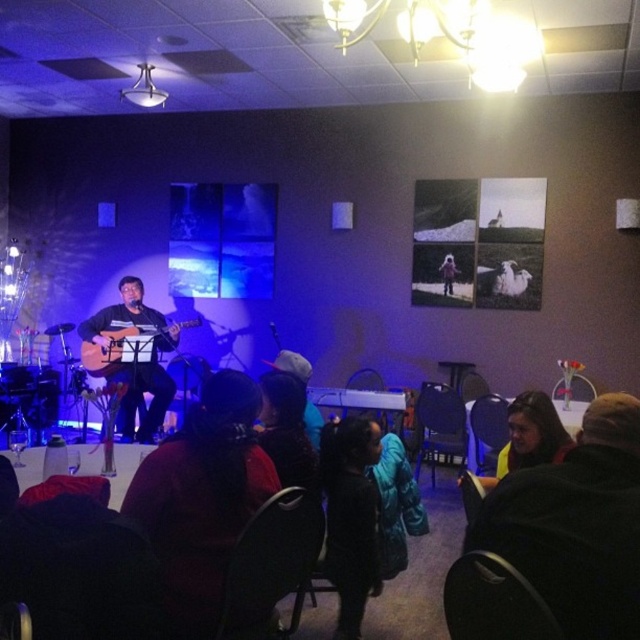
Question: Which of the following is the closest to the observer?

Choices:
 (A) matte black guitar at left
 (B) matte black guitar at center

Answer: (B)

Question: Which of the following is the farthest from the observer?

Choices:
 (A) matte black guitar at center
 (B) matte black guitar at left

Answer: (B)

Question: Is matte black guitar at center smaller than matte black guitar at left?

Choices:
 (A) yes
 (B) no

Answer: (B)

Question: Is the position of matte black guitar at center less distant than that of matte black guitar at left?

Choices:
 (A) no
 (B) yes

Answer: (B)

Question: Can you confirm if matte black guitar at center is bigger than matte black guitar at left?

Choices:
 (A) no
 (B) yes

Answer: (B)